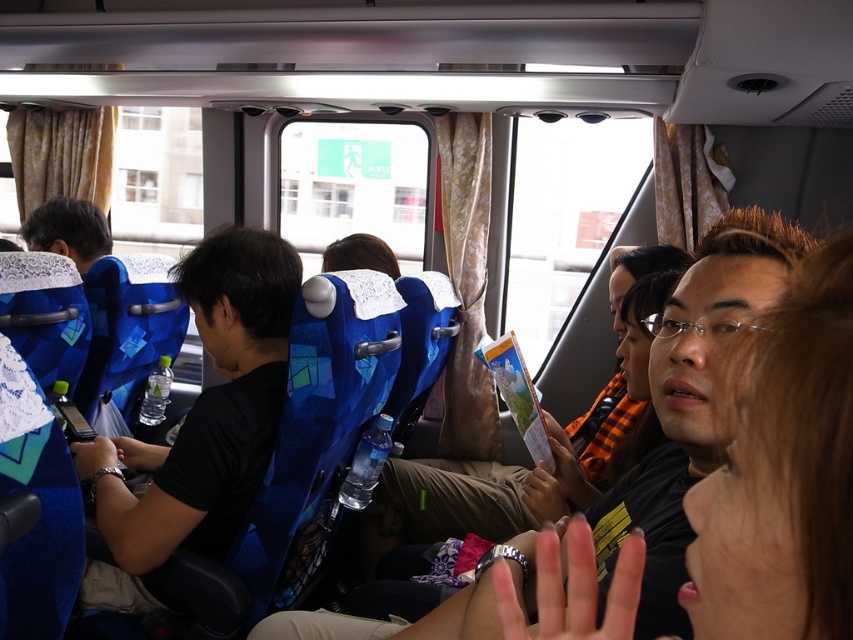
Question: Which object appears farthest from the camera in this image?

Choices:
 (A) black matte shirt at center
 (B) matte black hair at left

Answer: (B)

Question: Does black matte shirt at center have a greater width compared to matte black hair at left?

Choices:
 (A) no
 (B) yes

Answer: (B)

Question: Does black matte shirt at center appear under matte black hair at left?

Choices:
 (A) no
 (B) yes

Answer: (B)

Question: Among these points, which one is farthest from the camera?

Choices:
 (A) (47, 224)
 (B) (212, 556)

Answer: (A)

Question: Considering the relative positions of black matte shirt at center and matte black hair at left in the image provided, where is black matte shirt at center located with respect to matte black hair at left?

Choices:
 (A) below
 (B) above

Answer: (A)

Question: Which point appears farthest from the camera in this image?

Choices:
 (A) (212, 499)
 (B) (25, 220)

Answer: (B)